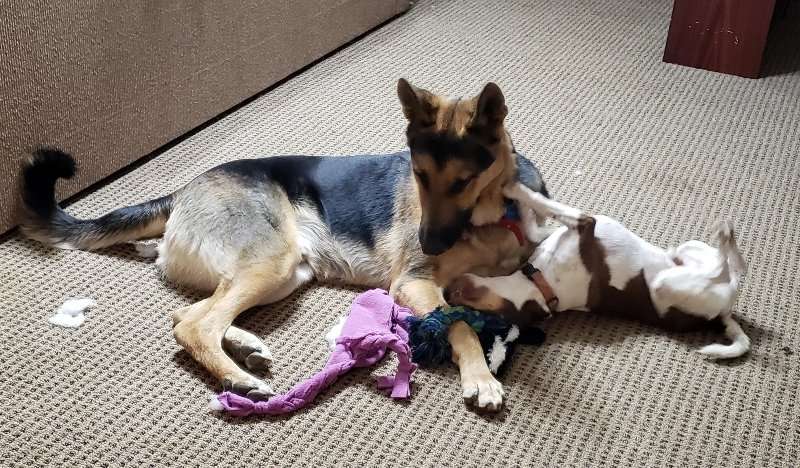
Where is `carpeted floor`? carpeted floor is located at coordinates (342, 125).